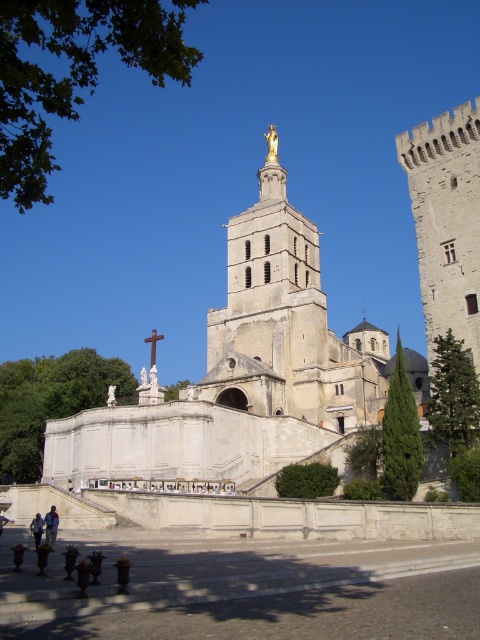
Which is in front, point (153, 346) or point (2, 522)?

Point (2, 522) is in front.

Is white wooden cross at upper center positioned before dark brown leather shoes at lower left?

No, white wooden cross at upper center is behind dark brown leather shoes at lower left.

Is point (151, 364) closer to camera compared to point (0, 513)?

No, (151, 364) is behind (0, 513).

Find the location of `white wooden cross at upper center`. white wooden cross at upper center is located at coordinates (153, 344).

Between dark blue jeans at lower left and white wooden cross at upper center, which one has more height?

Standing taller between the two is white wooden cross at upper center.

Who is higher up, dark blue jeans at lower left or white wooden cross at upper center?

Positioned higher is white wooden cross at upper center.

I want to click on dark blue jeans at lower left, so click(36, 529).

Can you confirm if light blue fabric jacket at lower left is shorter than dark brown leather shoes at lower left?

Indeed, light blue fabric jacket at lower left has a lesser height compared to dark brown leather shoes at lower left.

Does point (47, 536) come closer to viewer compared to point (6, 516)?

Yes, point (47, 536) is closer to viewer.

In order to click on light blue fabric jacket at lower left in this screenshot , I will do click(x=50, y=525).